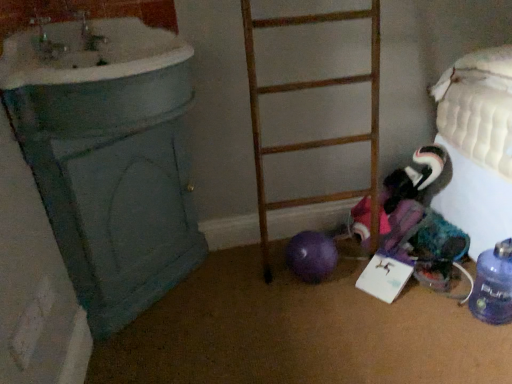
In order to face white glossy sink at upper left, should I rotate leftwards or rightwards?

Rotate your view left by about 18.605°.

At what (x,y) coordinates should I click in order to perform the action: click on white glossy sink at upper left. Please return your answer as a coordinate pair (x, y). Looking at the image, I should click on (99, 74).

Image resolution: width=512 pixels, height=384 pixels. I want to click on blue translucent bottle at lower right, so click(x=493, y=285).

Is the position of wooden ladder at center more distant than that of white glossy sink at upper left?

That is True.

In the scene shown: In terms of width, does wooden ladder at center look wider or thinner when compared to white glossy sink at upper left?

In the image, wooden ladder at center appears to be more narrow than white glossy sink at upper left.

How distant is white glossy sink at upper left from wooden ladder at center?

white glossy sink at upper left and wooden ladder at center are 50.77 centimeters apart from each other.

Is white glossy sink at upper left shorter than wooden ladder at center?

Yes, white glossy sink at upper left is shorter than wooden ladder at center.

From a real-world perspective, is white glossy sink at upper left located beneath wooden ladder at center?

Actually, white glossy sink at upper left is physically above wooden ladder at center in the real world.

From the image's perspective, is white glossy sink at upper left located above or below wooden ladder at center?

white glossy sink at upper left is above wooden ladder at center.

Between white glossy sink at upper left and blue translucent bottle at lower right, which one appears on the right side from the viewer's perspective?

From the viewer's perspective, blue translucent bottle at lower right appears more on the right side.

Is white glossy sink at upper left oriented towards blue translucent bottle at lower right?

No, white glossy sink at upper left is not oriented towards blue translucent bottle at lower right.

Who is taller, white glossy sink at upper left or blue translucent bottle at lower right?

Standing taller between the two is blue translucent bottle at lower right.

Locate an element on the screen. bottle lying below the wooden ladder at center (from the image's perspective) is located at coordinates coord(493,285).

Is wooden ladder at center thinner than blue translucent bottle at lower right?

No, wooden ladder at center is not thinner than blue translucent bottle at lower right.

Is wooden ladder at center oriented towards blue translucent bottle at lower right?

No, wooden ladder at center is not oriented towards blue translucent bottle at lower right.

Does point (323, 144) lie in front of point (511, 268)?

No, it is behind (511, 268).

How different are the orientations of blue translucent bottle at lower right and wooden ladder at center in degrees?

There is a 91.4-degree angle between the facing directions of blue translucent bottle at lower right and wooden ladder at center.

Which is behind, point (511, 238) or point (352, 194)?

The point (352, 194) is farther.

From a real-world perspective, between blue translucent bottle at lower right and wooden ladder at center, who is vertically lower?

blue translucent bottle at lower right.

Is blue translucent bottle at lower right facing towards wooden ladder at center?

No, blue translucent bottle at lower right is not aimed at wooden ladder at center.

How many degrees apart are the facing directions of blue translucent bottle at lower right and white glossy sink at upper left?

The angle between the facing direction of blue translucent bottle at lower right and the facing direction of white glossy sink at upper left is 91.4 degrees.

Considering the sizes of objects blue translucent bottle at lower right and white glossy sink at upper left in the image provided, who is shorter, blue translucent bottle at lower right or white glossy sink at upper left?

Standing shorter between the two is white glossy sink at upper left.

Find the location of `sink above the blue translucent bottle at lower right (from a real-world perspective)`. sink above the blue translucent bottle at lower right (from a real-world perspective) is located at coordinates (99, 74).

Considering the sizes of objects blue translucent bottle at lower right and white glossy sink at upper left in the image provided, who is thinner, blue translucent bottle at lower right or white glossy sink at upper left?

Thinner between the two is blue translucent bottle at lower right.

Find the location of `ladder below the white glossy sink at upper left (from the image's perspective)`. ladder below the white glossy sink at upper left (from the image's perspective) is located at coordinates (316, 140).

You are a GUI agent. You are given a task and a screenshot of the screen. Output one action in this format:
    pyautogui.click(x=<x>, y=<y>)
    Task: Click on the ladder that is on the right side of white glossy sink at upper left
    
    Given the screenshot: What is the action you would take?
    pyautogui.click(x=316, y=140)

Which object lies further to the anchor point wooden ladder at center, blue translucent bottle at lower right or white glossy sink at upper left?

blue translucent bottle at lower right.

Which object lies nearer to the anchor point white glossy sink at upper left, blue translucent bottle at lower right or wooden ladder at center?

wooden ladder at center is positioned closer to the anchor white glossy sink at upper left.

Based on their spatial positions, is wooden ladder at center or blue translucent bottle at lower right further from white glossy sink at upper left?

blue translucent bottle at lower right lies further to white glossy sink at upper left than the other object.

When comparing their distances from blue translucent bottle at lower right, does wooden ladder at center or white glossy sink at upper left seem closer?

Based on the image, wooden ladder at center appears to be nearer to blue translucent bottle at lower right.

Consider the image. Estimate the real-world distances between objects in this image. Which object is further from blue translucent bottle at lower right, white glossy sink at upper left or wooden ladder at center?

white glossy sink at upper left lies further to blue translucent bottle at lower right than the other object.

Based on their spatial positions, is white glossy sink at upper left or blue translucent bottle at lower right further from wooden ladder at center?

blue translucent bottle at lower right lies further to wooden ladder at center than the other object.

Where is `ladder between white glossy sink at upper left and blue translucent bottle at lower right from left to right`? The image size is (512, 384). ladder between white glossy sink at upper left and blue translucent bottle at lower right from left to right is located at coordinates (316, 140).